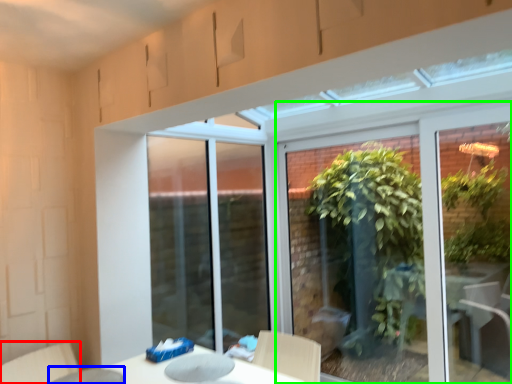
Question: Estimate the real-world distances between objects in this image. Which object is closer to swivel chair (highlighted by a red box), glass table (highlighted by a blue box) or window (highlighted by a green box)?

Choices:
 (A) glass table
 (B) window

Answer: (A)